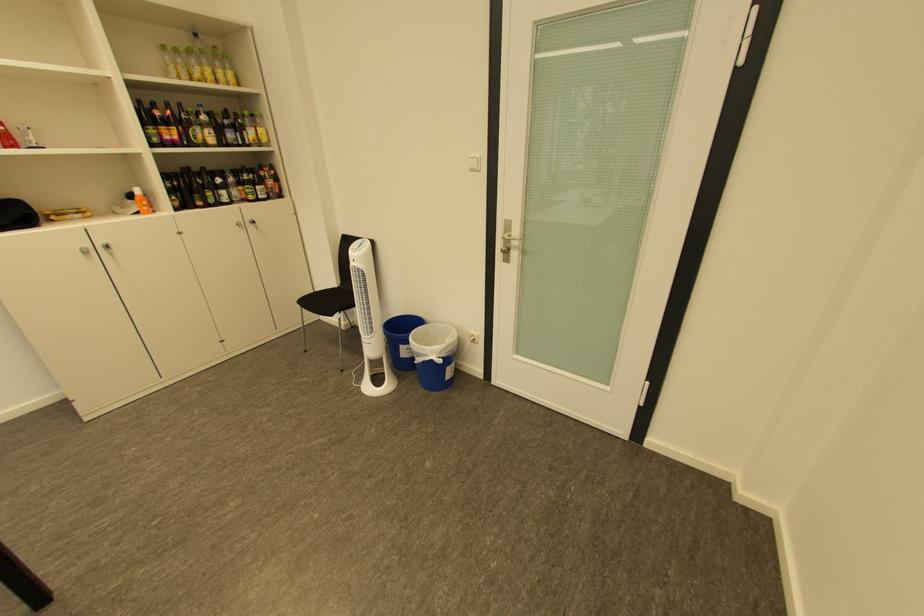
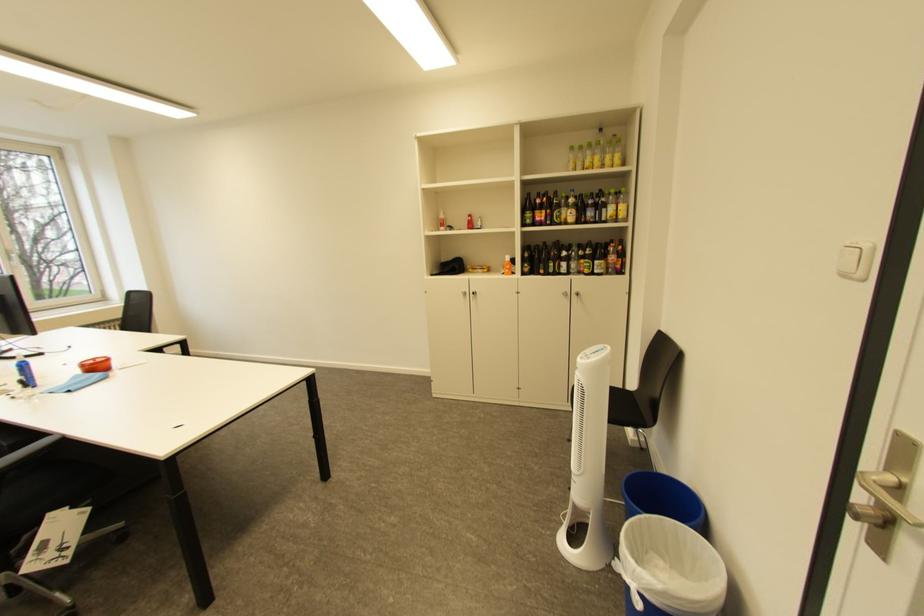
Locate, in the second image, the point that corresponds to the point at 229,146 in the first image.

(587, 224)